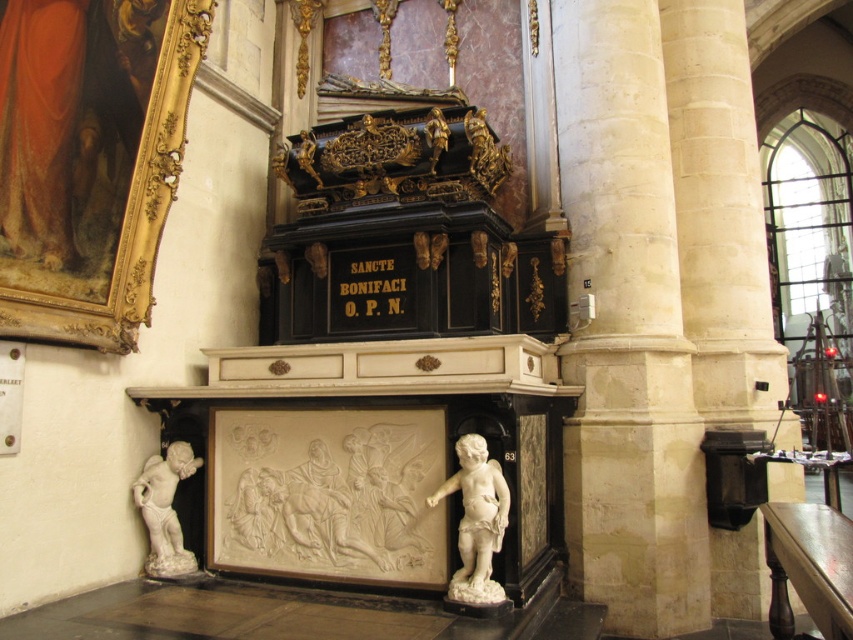
Question: Is white marble fireplace at center further to the viewer compared to white marble cherub at lower left?

Choices:
 (A) no
 (B) yes

Answer: (A)

Question: Which object is the farthest from the white marble cherub at lower right?

Choices:
 (A) white marble fireplace at center
 (B) white marble cherub at lower left

Answer: (B)

Question: Is white marble cherub at lower right closer to camera compared to white marble cherub at lower left?

Choices:
 (A) no
 (B) yes

Answer: (B)

Question: Among these objects, which one is farthest from the camera?

Choices:
 (A) white marble fireplace at center
 (B) white marble cherub at lower left
 (C) white marble cherub at lower right

Answer: (B)

Question: Does white marble fireplace at center appear on the left side of white marble cherub at lower right?

Choices:
 (A) yes
 (B) no

Answer: (A)

Question: Considering the real-world distances, which object is closest to the white marble fireplace at center?

Choices:
 (A) white marble cherub at lower left
 (B) white marble cherub at lower right

Answer: (B)